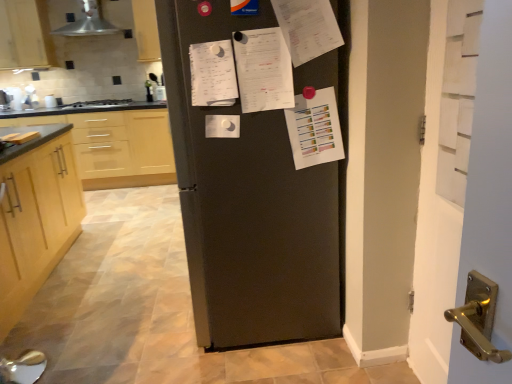
Question: In the image, is white painted wood door at right positioned in front of or behind light wood cabinet at left, the first cabinetry from the front?

Choices:
 (A) front
 (B) behind

Answer: (A)

Question: Is white painted wood door at right taller or shorter than light wood cabinet at left, the first cabinetry from the front?

Choices:
 (A) tall
 (B) short

Answer: (A)

Question: Considering the real-world distances, which object is farthest from the metallic silver exhaust hood at upper left?

Choices:
 (A) white matte paper at center
 (B) white paper at center, which appears as the 1th list when viewed from the right
 (C) matte wood cabinet at upper left, which appears as the second cabinetry when viewed from the back
 (D) light wood cabinet at left, arranged as the 3th cabinetry when viewed from the top
 (E) white paper at upper right

Answer: (E)

Question: Estimate the real-world distances between objects in this image. Which object is closer to the matte black fridge at center?

Choices:
 (A) white matte paper at center
 (B) light wood cabinet at left, which is counted as the third cabinetry, starting from the back
 (C) light wood cabinetry at left, the third cabinetry positioned from the front
 (D) black matte gas stove at left
 (E) white painted wood door at right

Answer: (A)